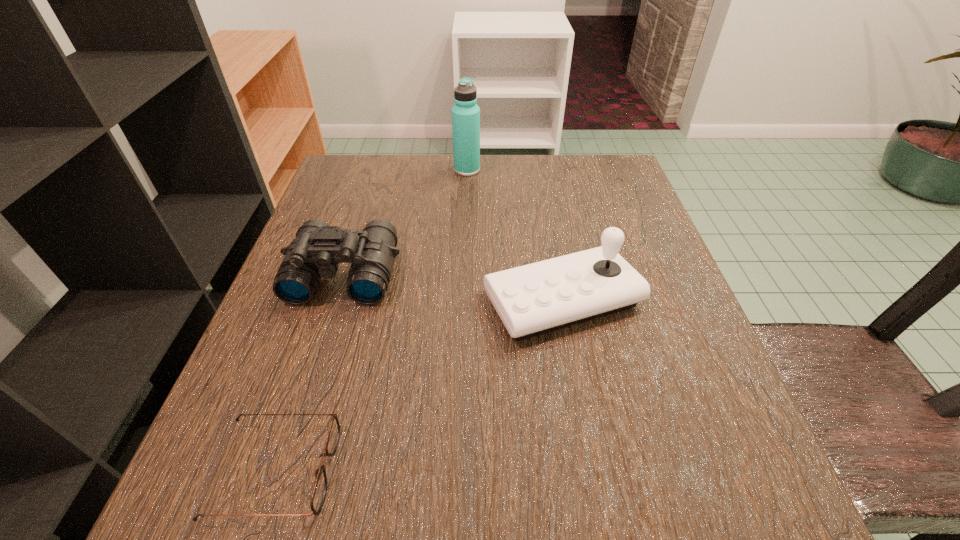
In the image, there is a desktop. Find the location of `vacant space at the near left corner`. vacant space at the near left corner is located at coordinates (218, 532).

The height and width of the screenshot is (540, 960). I want to click on vacant space at the far right corner of the desktop, so (590, 181).

I want to click on vacant region at the near right corner of the desktop, so click(709, 492).

Find the location of a particular element. The width and height of the screenshot is (960, 540). vacant space in between the rightmost object and the thermos bottle is located at coordinates (515, 235).

In order to click on unoccupied position between the sunglasses and the joystick in this screenshot , I will do `click(420, 386)`.

Locate an element on the screen. The image size is (960, 540). vacant area that lies between the joystick and the second shortest object is located at coordinates (453, 287).

The width and height of the screenshot is (960, 540). In order to click on vacant area that lies between the shortest object and the tallest object in this screenshot , I will do `click(372, 320)`.

Locate an element on the screen. empty location between the shortest object and the thermos bottle is located at coordinates (372, 320).

At what (x,y) coordinates should I click in order to perform the action: click on free space between the rightmost object and the shortest object. Please return your answer as a coordinate pair (x, y). The width and height of the screenshot is (960, 540). Looking at the image, I should click on (420, 386).

Locate an element on the screen. The width and height of the screenshot is (960, 540). vacant area that lies between the sunglasses and the binoculars is located at coordinates (310, 373).